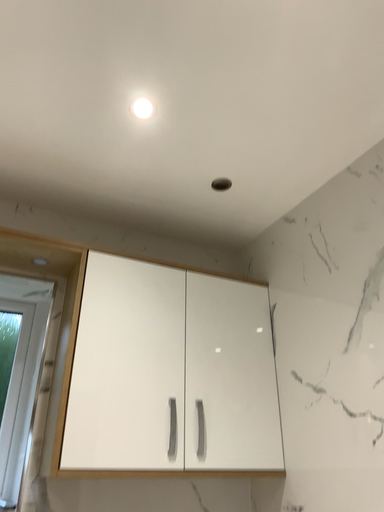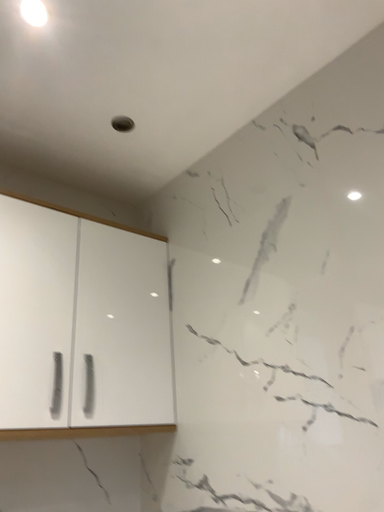
Question: How did the camera likely rotate when shooting the video?

Choices:
 (A) rotated right
 (B) rotated left

Answer: (A)